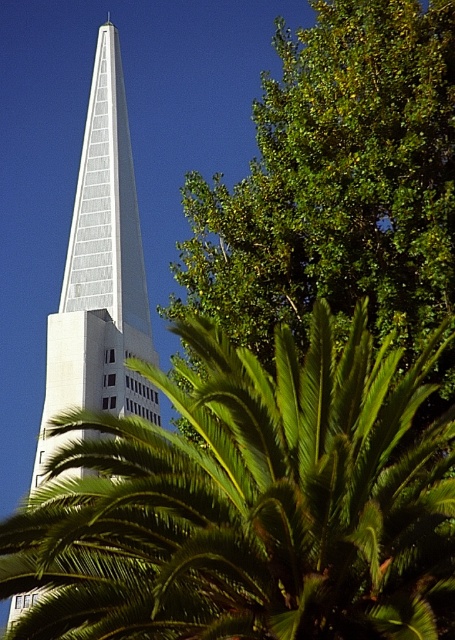
Is green leafy tree at upper right smaller than glassy white spire at center?

Indeed, green leafy tree at upper right has a smaller size compared to glassy white spire at center.

Is point (368, 156) positioned behind point (75, 288)?

That is False.

This screenshot has width=455, height=640. Find the location of `green leafy tree at upper right`. green leafy tree at upper right is located at coordinates (335, 182).

From the picture: Does green leafy palm tree at lower left appear on the left side of green leafy tree at upper right?

Correct, you'll find green leafy palm tree at lower left to the left of green leafy tree at upper right.

Is point (357, 490) positioned before point (433, 312)?

Yes, it is in front of point (433, 312).

Between point (213, 368) and point (297, 198), which one is positioned behind?

The point (297, 198) is behind.

In order to click on green leafy palm tree at lower left in this screenshot , I will do `click(247, 502)`.

Can you confirm if green leafy palm tree at lower left is taller than glassy white spire at center?

No, green leafy palm tree at lower left is not taller than glassy white spire at center.

Does point (287, 392) lie in front of point (121, 276)?

That is True.

The image size is (455, 640). Find the location of `green leafy palm tree at lower left`. green leafy palm tree at lower left is located at coordinates (247, 502).